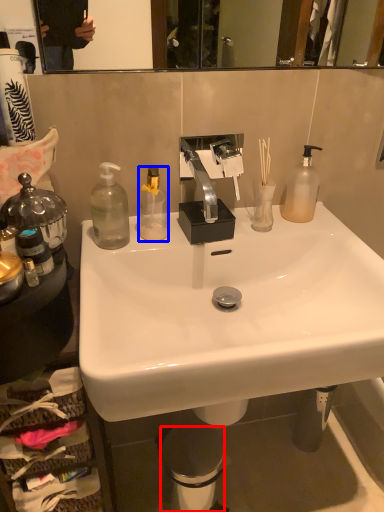
Question: Among these objects, which one is farthest to the camera, trash bin/can (highlighted by a red box) or bottle (highlighted by a blue box)?

Choices:
 (A) trash bin/can
 (B) bottle

Answer: (A)